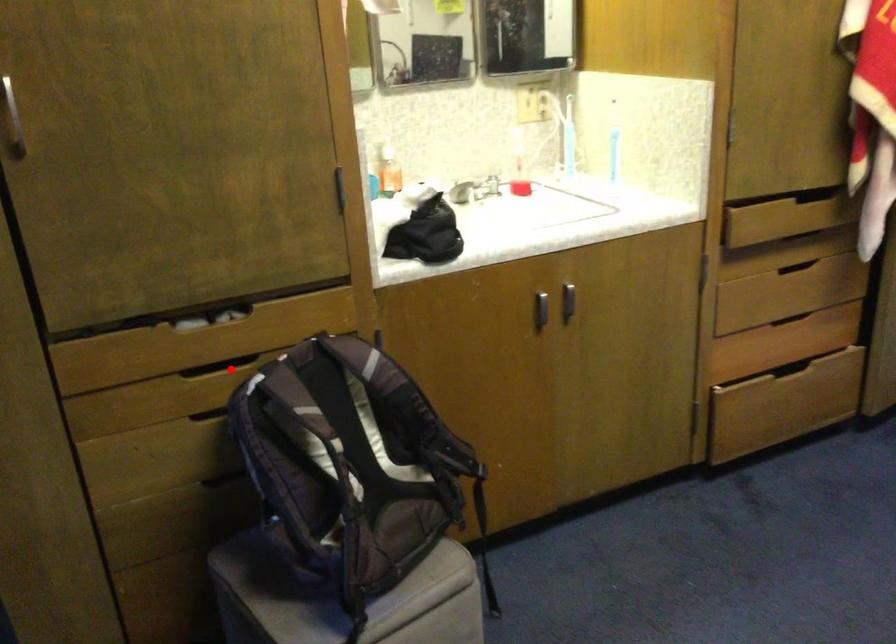
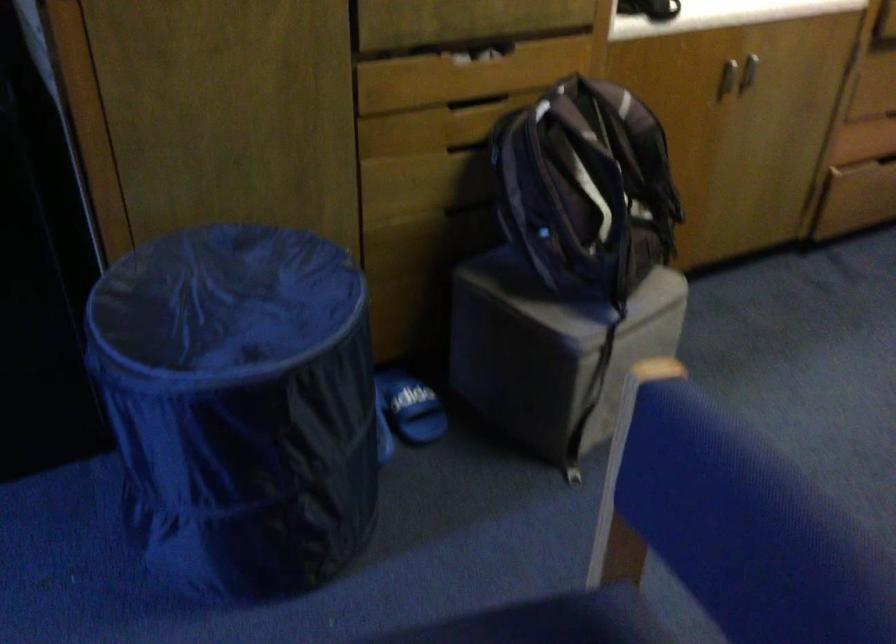
Question: I am providing you with two images of the same scene from different viewpoints. Image1 has a red point marked. In image2, the corresponding 3D location appears at what relative position? Reply with the corresponding letter.

Choices:
 (A) Closer
 (B) Farther

Answer: (B)